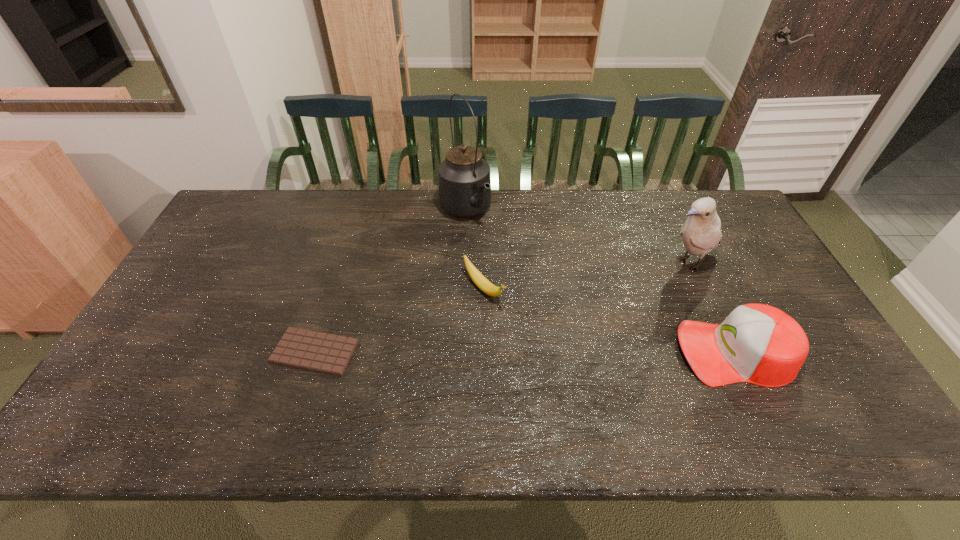
Identify the location of object positioned at the far edge. (464, 184).

Find the location of a particular element. The height and width of the screenshot is (540, 960). chocolate bar positioned at the near edge is located at coordinates (310, 350).

Find the location of a particular element. baseball cap that is at the near edge is located at coordinates (759, 344).

In order to click on baseball cap present at the right edge in this screenshot , I will do pos(759,344).

What are the coordinates of `bird located at the right edge` in the screenshot? It's located at (701, 232).

This screenshot has width=960, height=540. Find the location of `object present at the near right corner`. object present at the near right corner is located at coordinates (759, 344).

At what (x,y) coordinates should I click in order to perform the action: click on vacant space at the far edge. Please return your answer as a coordinate pair (x, y). The image size is (960, 540). Looking at the image, I should click on (602, 229).

Image resolution: width=960 pixels, height=540 pixels. Find the location of `free space at the near edge of the desktop`. free space at the near edge of the desktop is located at coordinates (370, 382).

Identify the location of vacant space at the left edge of the desktop. (175, 326).

In the image, there is a desktop. Where is `free space at the right edge`? free space at the right edge is located at coordinates (776, 300).